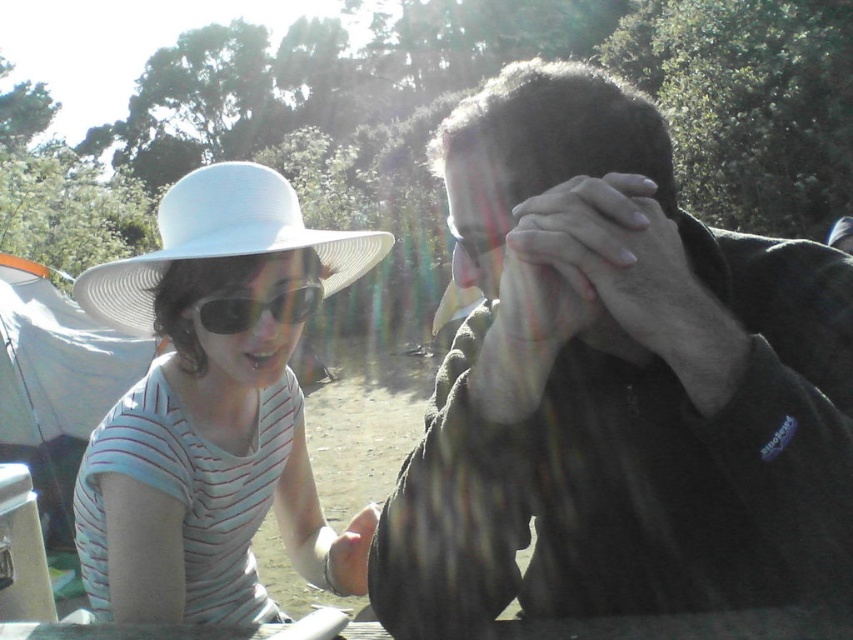
Question: Can you confirm if white matte hat at left is positioned to the right of matte black face at center?

Choices:
 (A) yes
 (B) no

Answer: (B)

Question: Among these points, which one is farthest from the camera?

Choices:
 (A) (287, 314)
 (B) (345, 266)
 (C) (525, 225)

Answer: (B)

Question: Is the position of dark green fleece at center more distant than that of matte black face at center?

Choices:
 (A) yes
 (B) no

Answer: (B)

Question: Does white matte hat at left appear under matte black sunglasses at left?

Choices:
 (A) no
 (B) yes

Answer: (B)

Question: Which point is closer to the camera taking this photo?

Choices:
 (A) (207, 317)
 (B) (448, 168)
 (C) (186, 394)

Answer: (B)

Question: Which point is farther to the camera?

Choices:
 (A) (218, 227)
 (B) (624, 493)

Answer: (A)